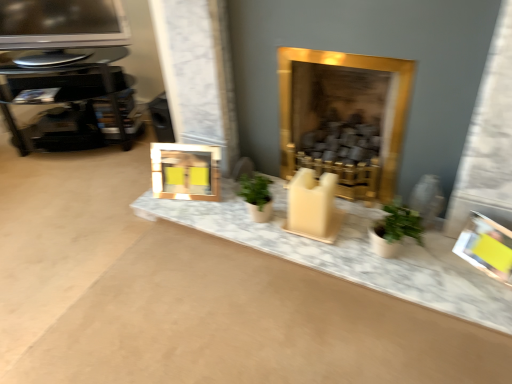
Locate an element on the screen. The width and height of the screenshot is (512, 384). vacant region to the left of marble counter top at center is located at coordinates (113, 245).